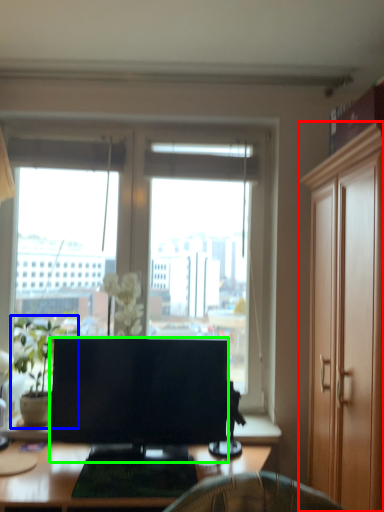
Question: Which object is the closest to the cabinetry (highlighted by a red box)? Choose among these: houseplant (highlighted by a blue box) or television (highlighted by a green box).

Choices:
 (A) houseplant
 (B) television

Answer: (B)